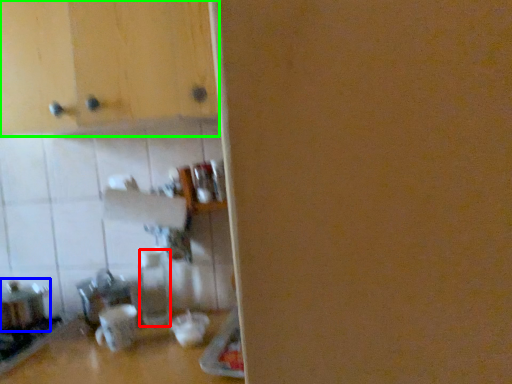
Question: Which object is the farthest from bottle (highlighted by a red box)? Choose among these: appliance (highlighted by a blue box) or cabinetry (highlighted by a green box).

Choices:
 (A) appliance
 (B) cabinetry

Answer: (B)